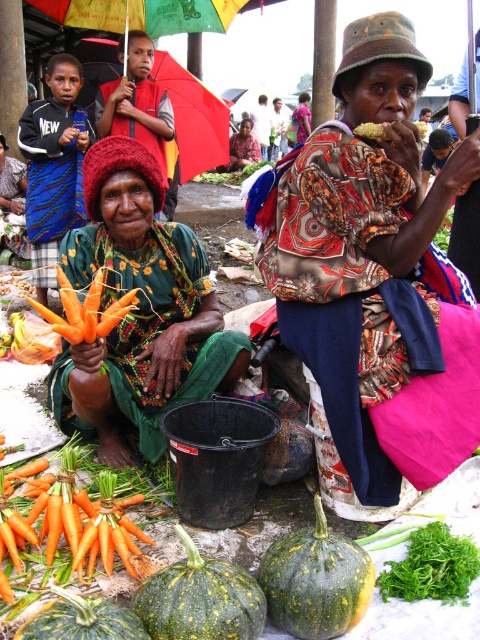
You are standing in the market scene and want to determine which of the two points, point (x=142, y=572) or point (x=70, y=333), is closer to you. Based on the description, which point is nearer?

Point (x=142, y=572) is further to the viewer than point (x=70, y=333). Therefore, point (x=70, y=333) is closer to you.

You are a customer at the market and want to pick up the green spotted squash at lower left. Can you reach it without moving the orange smooth carrot at lower left?

The green spotted squash at lower left is behind orange smooth carrot at lower left, so you can reach it without moving the orange smooth carrot at lower left.

You are a photographer trying to capture a closeup shot of the orange smooth carrot at lower left. Your camera has a minimum focusing distance of 6 feet. Will you be able to take the photo without moving closer than 6 feet?

The orange smooth carrot at lower left is 5.88 feet from the camera, which is within the minimum focusing distance of 6 feet. Therefore, you can take the photo without moving closer than 6 feet.